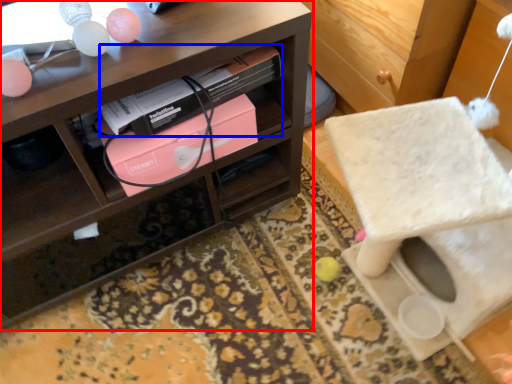
Question: Among these objects, which one is farthest to the camera, shelf (highlighted by a red box) or book (highlighted by a blue box)?

Choices:
 (A) shelf
 (B) book

Answer: (B)